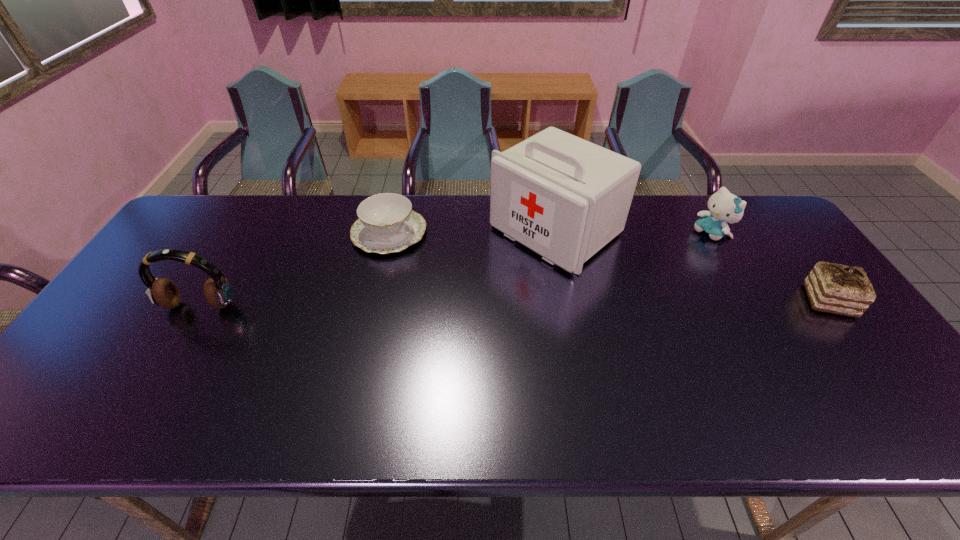
In order to click on free spot on the desktop that is between the leftmost object and the chocolate cake and is positioned on the front-facing side of the first-aid kit in this screenshot , I will do pos(456,303).

Find the location of `free space on the desktop that is between the leftmost object and the chocolate cake and is positioned on the face of the kitten`. free space on the desktop that is between the leftmost object and the chocolate cake and is positioned on the face of the kitten is located at coordinates (596, 302).

The image size is (960, 540). I want to click on free space on the desktop that is between the second tallest object and the chocolate cake and is positioned on the handle side of the second object from left to right, so click(x=504, y=303).